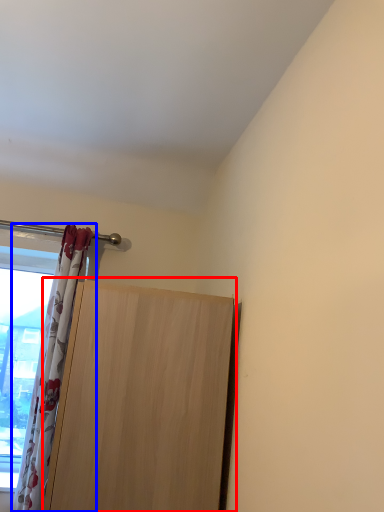
Question: Which of the following is the closest to the observer, door (highlighted by a red box) or curtain (highlighted by a blue box)?

Choices:
 (A) door
 (B) curtain

Answer: (A)